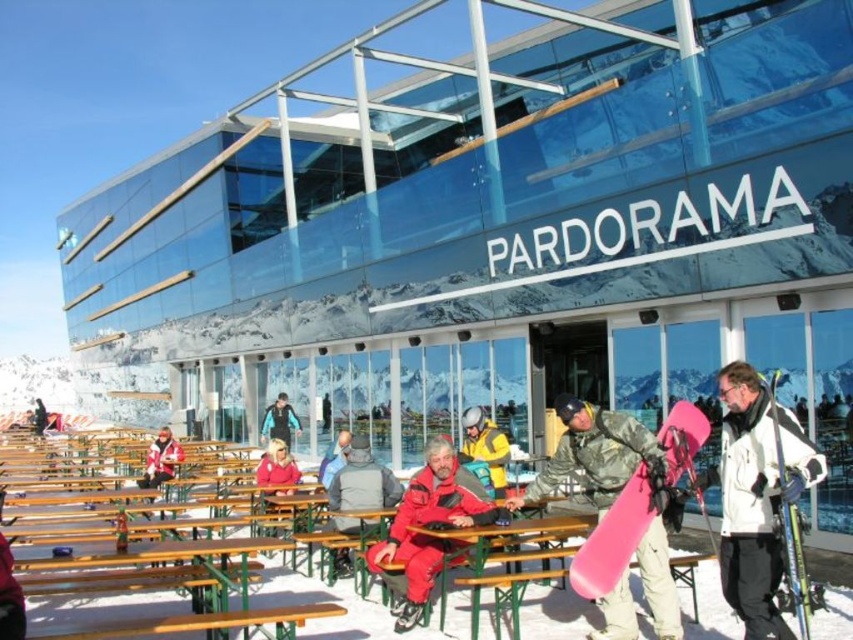
You are a photographer standing at the camera position. You want to capture a closeup shot of the matte red ski suit at center. Given that your camera has a maximum zoom range of 100 feet, is it possible to get a clear closeup without moving closer?

The matte red ski suit at center and camera are 99.39 feet apart. Since the maximum zoom range of the camera is 100 feet, it is possible to capture a clear closeup without moving closer.

You are standing at the viewing balcony of the PARDORAMA building and looking down at the people below. You see a matte red ski suit at center and a matte yellow jacket at center. Which one is closer to the balcony?

The matte red ski suit at center is located below the matte yellow jacket at center, so the matte yellow jacket at center is closer to the balcony.

You are standing at the point labeled as point (x=393, y=628). You want to reach the entrance of the building with the white letters PARDORAMA. Which direction should you move to get closer to the entrance?

Since the entrance is part of the building with the white letters PARDORAMA, which is located at the top of the structure, you should move upwards from point (x=393, y=628) to get closer to the entrance.